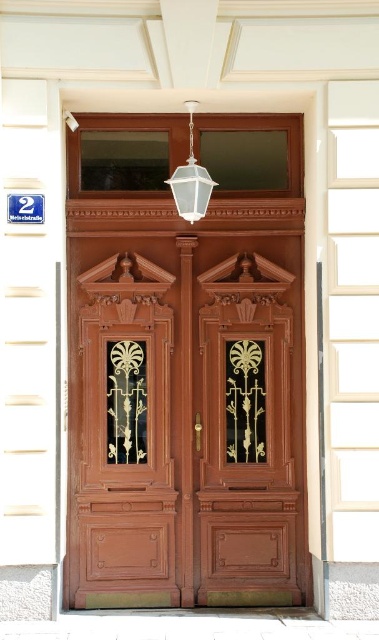
You are standing in front of the double doors and want to enter the building. Which door should you open first, the matte wood door at center or the polished wood door at center?

The matte wood door at center is in front of the polished wood door at center, so you should open the matte wood door at center first to enter the building.

You are a painter who needs to paint both the matte wood door at center and the polished wood door at center. The spray can you have can only paint an area within 30 centimeters. Can you paint both doors without moving the spray can?

The matte wood door at center is 32.57 centimeters from polished wood door at center. Since the spray can can only paint within 30 centimeters, you cannot paint both doors without moving the spray can because the distance between them exceeds the spray can range.

You are an interior designer assessing the entranceway. You need to determine if a new decorative item, which is the size of the clear glass lantern at upper center, can be placed on the matte wood door at center without covering more than 30 percent of its surface area. Can this be done?

The matte wood door at center is bigger than the clear glass lantern at upper center. Since the lantern is smaller, placing it on the door would cover less than 30 percent of the door, so it is possible.